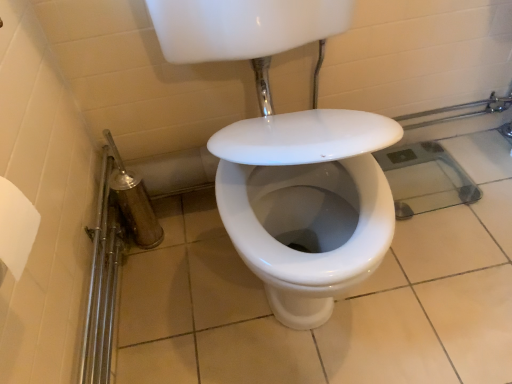
At what (x,y) coordinates should I click in order to perform the action: click on empty space that is in between white glossy sink at center and shiny metallic shower at lower left. Please return your answer as a coordinate pair (x, y). The height and width of the screenshot is (384, 512). Looking at the image, I should click on (185, 280).